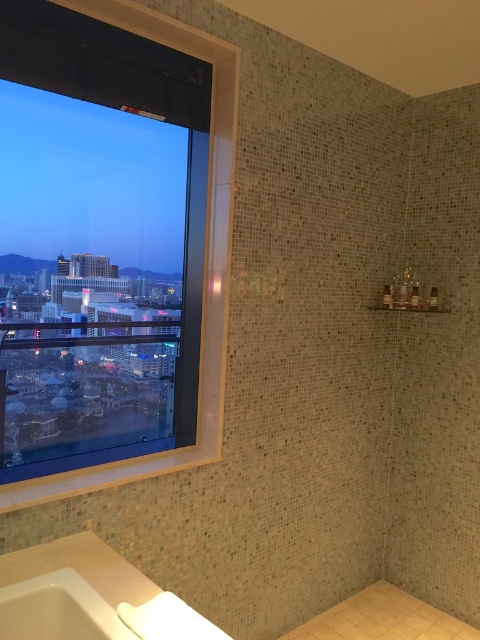
Question: From the image, what is the correct spatial relationship of transparent glass window at left in relation to white ceramic bath at lower left?

Choices:
 (A) right
 (B) left

Answer: (A)

Question: Which of the following is the closest to the observer?

Choices:
 (A) (229, 113)
 (B) (37, 602)

Answer: (B)

Question: Among these objects, which one is farthest from the camera?

Choices:
 (A) white ceramic bath at lower left
 (B) transparent glass window at left

Answer: (B)

Question: Is transparent glass window at left above white ceramic bath at lower left?

Choices:
 (A) no
 (B) yes

Answer: (B)

Question: Is transparent glass window at left bigger than white ceramic bath at lower left?

Choices:
 (A) no
 (B) yes

Answer: (B)

Question: Which object is closer to the camera taking this photo?

Choices:
 (A) white ceramic bath at lower left
 (B) transparent glass window at left

Answer: (A)